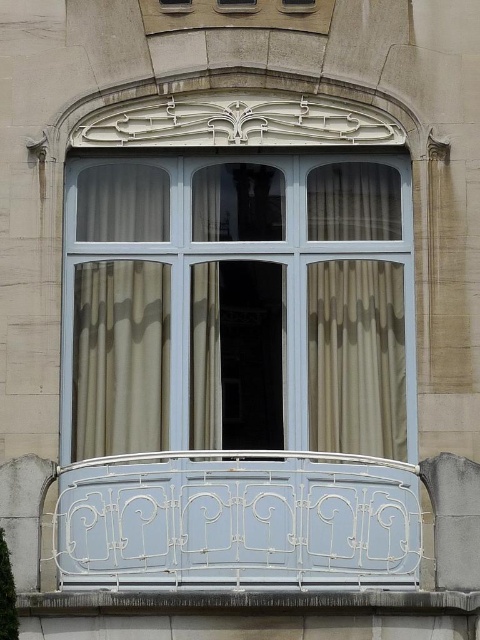
Question: Based on their relative distances, which object is farther from the beige sheer curtain at left?

Choices:
 (A) concrete at lower center
 (B) beige textured curtain at center
 (C) white wrought iron balcony at lower center

Answer: (A)

Question: Which point is farther to the camera?

Choices:
 (A) (337, 272)
 (B) (142, 164)
 (C) (360, 516)
 (D) (197, 308)

Answer: (B)

Question: Is white wrought iron balcony at lower center positioned in front of beige sheer curtain at left?

Choices:
 (A) no
 (B) yes

Answer: (B)

Question: Which of the following is the closest to the observer?

Choices:
 (A) (126, 404)
 (B) (328, 371)
 (C) (200, 358)
 (D) (129, 605)

Answer: (D)

Question: Can you confirm if concrete at lower center is positioned above silky beige curtain at center?

Choices:
 (A) yes
 (B) no

Answer: (B)

Question: Does white wrought iron balcony at lower center have a greater width compared to beige textured curtain at center?

Choices:
 (A) yes
 (B) no

Answer: (B)